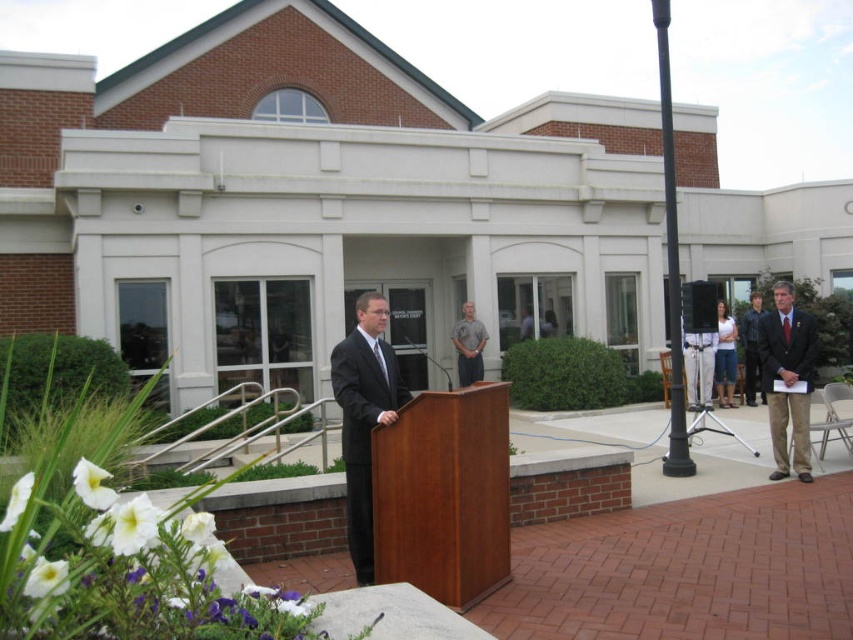
You are attending an event and see two people at the center of the scene, a gray cotton shirt at center and a white cotton shirt at center. Which one is shorter?

The gray cotton shirt at center is shorter than the white cotton shirt at center.

You are attending an event and need to locate the speaker who is standing behind the cherry wood podium at center. From your position, where would you look relative to the dark blue leather jacket at right?

The cherry wood podium at center is below the dark blue leather jacket at right, so you should look downward from the dark blue leather jacket at right to find the speaker behind the cherry wood podium at center.